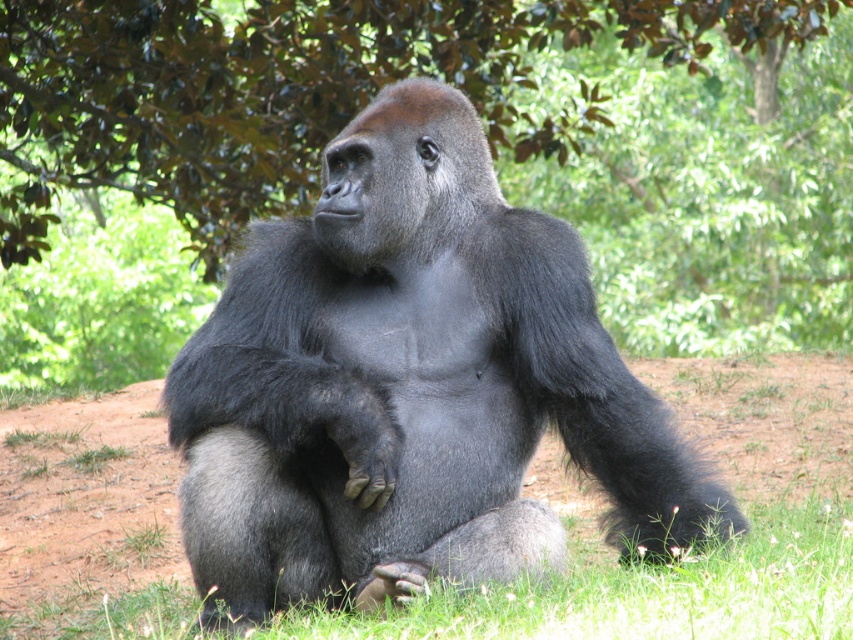
You are a visitor at the zoo and want to take a photo of the dark gray fur gorilla at center. You notice a green leafy tree at upper center in the background. Which side of the gorilla should you position the tree to ensure it appears on the right side of your photo?

The green leafy tree at upper center is already positioned on the right side of the dark gray fur gorilla at center, so positioning the tree on the right side of the gorilla in the photo will ensure it appears correctly.

You are a wildlife photographer aiming to capture the gorilla in the center of your photo. You notice a green leafy tree at upper center in the background. To ensure the tree is perfectly centered in your composition, where should you position the tree relative to the gorilla?

The green leafy tree at upper center is already positioned at point 0.200 on the x axis and 0.570 on the y axis, so to center it, you should adjust your camera so that the tree is aligned at the center coordinates of the image.